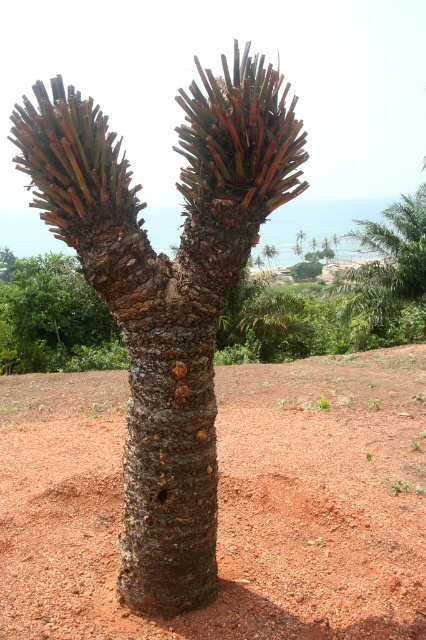
Question: Does brown soil at center lie in front of brown rough bark tree at center?

Choices:
 (A) no
 (B) yes

Answer: (B)

Question: Can you confirm if brown soil at center is bigger than brown rough bark tree at center?

Choices:
 (A) no
 (B) yes

Answer: (A)

Question: Which point is closer to the camera?

Choices:
 (A) brown soil at center
 (B) brown rough bark tree at center

Answer: (A)

Question: In this image, where is brown soil at center located relative to brown rough bark tree at center?

Choices:
 (A) right
 (B) left

Answer: (A)